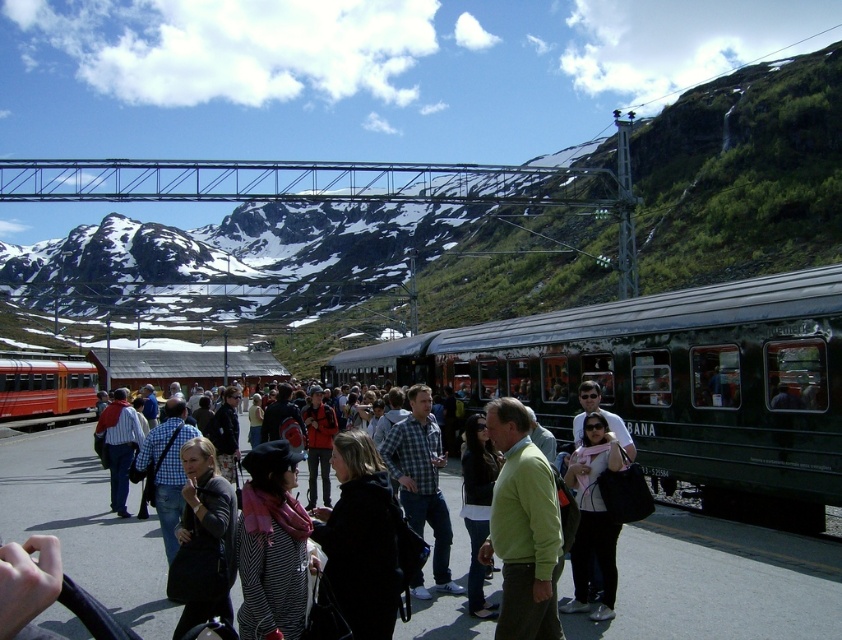
Who is more distant from viewer, (110, 545) or (587, 461)?

The point (110, 545) is more distant.

Where is `matte black people at center`? matte black people at center is located at coordinates (443, 620).

Locate an element on the screen. matte black people at center is located at coordinates (443, 620).

You are a GUI agent. You are given a task and a screenshot of the screen. Output one action in this format:
    pyautogui.click(x=<x>, y=<y>)
    Task: Click on the matte black people at center
    This screenshot has height=640, width=842.
    Given the screenshot: What is the action you would take?
    pyautogui.click(x=443, y=620)

In the scene shown: Is green matte train at center to the left of matte red train at left from the viewer's perspective?

Incorrect, green matte train at center is not on the left side of matte red train at left.

Who is positioned more to the right, green matte train at center or matte red train at left?

green matte train at center

You are a GUI agent. You are given a task and a screenshot of the screen. Output one action in this format:
    pyautogui.click(x=<x>, y=<y>)
    Task: Click on the green matte train at center
    
    Given the screenshot: What is the action you would take?
    pyautogui.click(x=669, y=385)

Is matte black jacket at center in front of matte red train at left?

Yes, matte black jacket at center is closer to the viewer.

Does matte black jacket at center have a larger size compared to matte red train at left?

No.

At what (x,y) coordinates should I click in order to perform the action: click on matte black jacket at center. Please return your answer as a coordinate pair (x, y). This screenshot has height=640, width=842. Looking at the image, I should click on tap(593, 516).